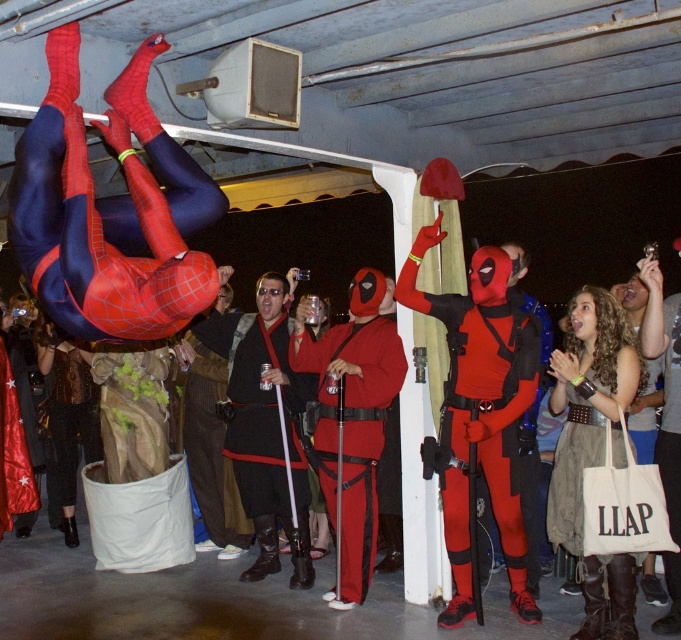
You are a photographer setting up a camera to capture the scene. You need to ensure that both the brown corduroy pants at center and the velvet black dress at lower left are in focus. Given that your camera has a depth of field that can cover 40 inches, will both objects be in focus?

The distance between the brown corduroy pants at center and the velvet black dress at lower left is 38.09 inches, which is within the camera depth of field of 40 inches. Therefore, both objects will be in focus.

You are a photographer setting up a shoot in the garage. You need to position a tripod so that both the brown corduroy pants at center and the velvet black dress at lower left are fully visible. Considering their heights, which one might require adjusting the camera angle upwards or downwards?

The velvet black dress at lower left is taller than the brown corduroy pants at center, so you would need to angle the camera downward to capture the taller velvet black dress and upward for the shorter brown corduroy pants at center.